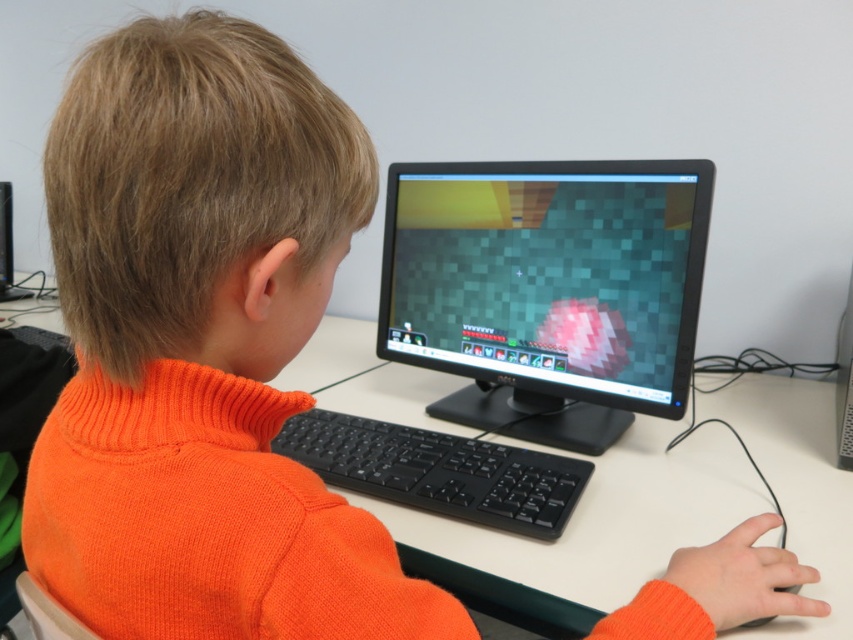
Question: Is black glossy monitor at center positioned at the back of black plastic keyboard at center?

Choices:
 (A) no
 (B) yes

Answer: (B)

Question: Which of the following is the farthest from the observer?

Choices:
 (A) (306, 422)
 (B) (683, 356)

Answer: (A)

Question: Which point is closer to the camera?

Choices:
 (A) black glossy monitor at center
 (B) black plastic keyboard at center

Answer: (B)

Question: Which point is closer to the camera?

Choices:
 (A) (567, 358)
 (B) (471, 488)

Answer: (B)

Question: Does black glossy monitor at center have a lesser width compared to black plastic keyboard at center?

Choices:
 (A) no
 (B) yes

Answer: (A)

Question: Is black glossy monitor at center to the right of black plastic keyboard at center from the viewer's perspective?

Choices:
 (A) yes
 (B) no

Answer: (A)